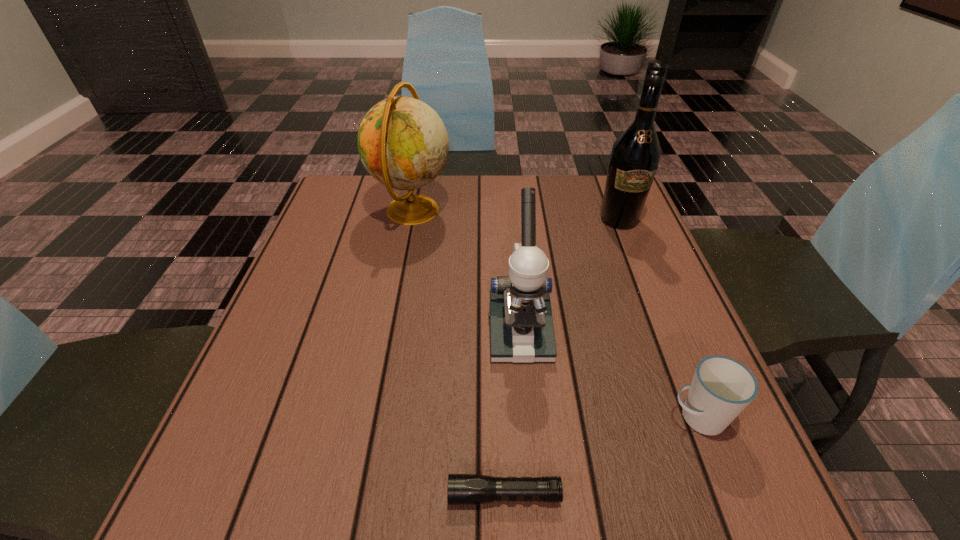
In order to click on wine bottle in this screenshot , I will do `click(635, 155)`.

At what (x,y) coordinates should I click in order to perform the action: click on the leftmost object. Please return your answer as a coordinate pair (x, y). The width and height of the screenshot is (960, 540). Looking at the image, I should click on (403, 143).

Locate an element on the screen. the third nearest object is located at coordinates (521, 324).

Find the location of `the second nearest object`. the second nearest object is located at coordinates (721, 388).

This screenshot has height=540, width=960. Find the location of `cup`. cup is located at coordinates (721, 388).

Where is `the shortest object`? The image size is (960, 540). the shortest object is located at coordinates (463, 489).

At what (x,y) coordinates should I click in order to perform the action: click on the nearest object. Please return your answer as a coordinate pair (x, y). The image size is (960, 540). Looking at the image, I should click on (463, 489).

In order to click on vacant space located on the label of the wine bottle in this screenshot , I will do (x=649, y=294).

Image resolution: width=960 pixels, height=540 pixels. I want to click on free location located 0.050m on the right of the globe, so click(x=471, y=211).

What are the coordinates of `vacant space situated 0.210m on the front of the third farthest object` in the screenshot? It's located at (532, 480).